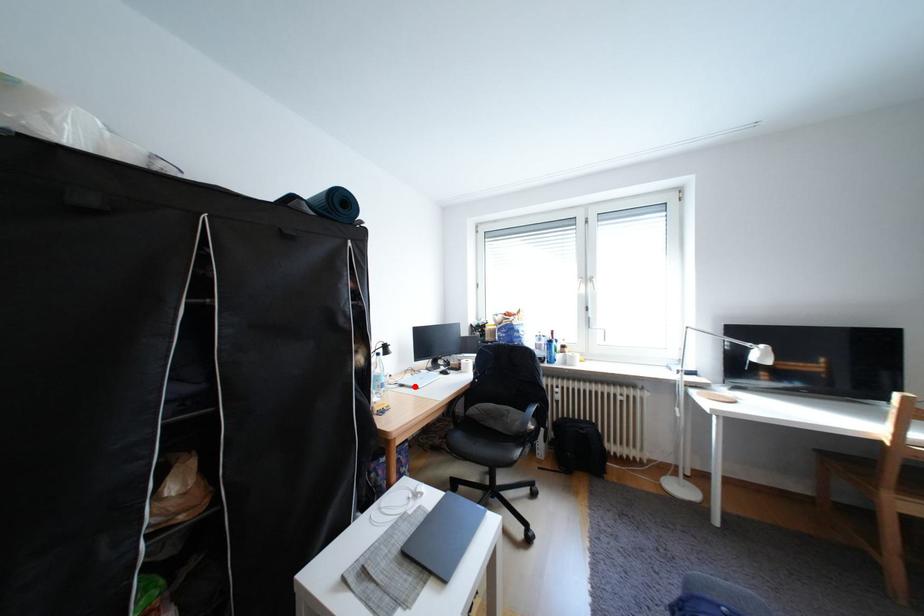
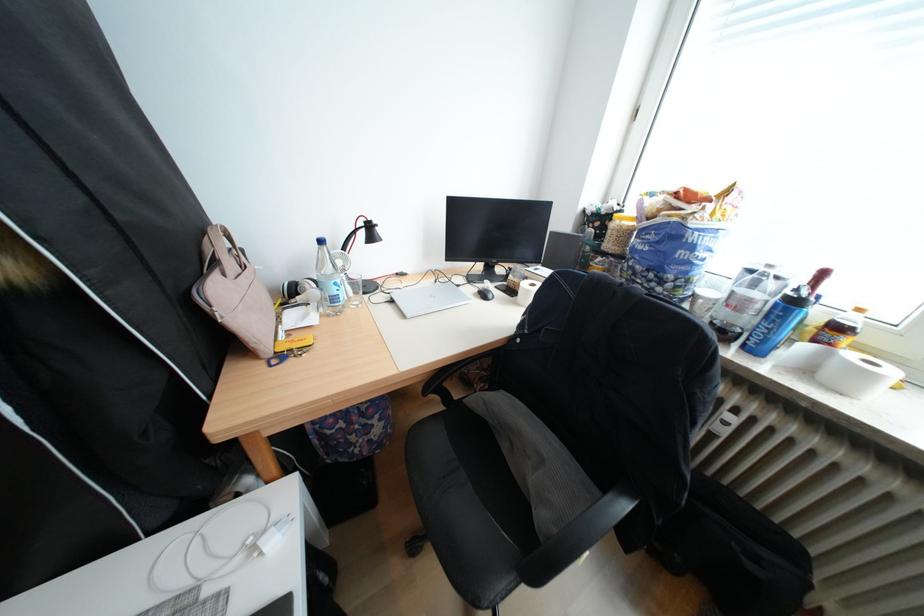
Locate, in the second image, the point that corresponds to the highlighted location in the first image.

(405, 302)